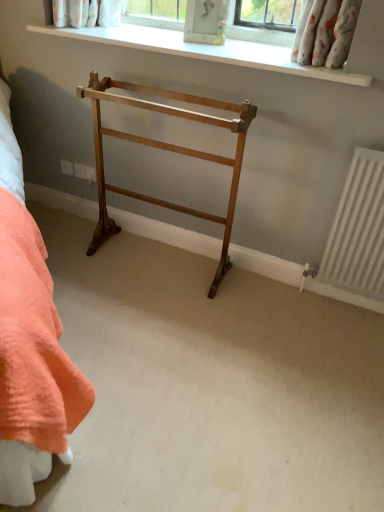
Question: Would you say white smooth window sill at upper center is outside light brown wood towel rack at center?

Choices:
 (A) no
 (B) yes

Answer: (B)

Question: Is white smooth window sill at upper center in contact with light brown wood towel rack at center?

Choices:
 (A) no
 (B) yes

Answer: (A)

Question: Is white smooth window sill at upper center taller than light brown wood towel rack at center?

Choices:
 (A) no
 (B) yes

Answer: (A)

Question: Is white smooth window sill at upper center bigger than light brown wood towel rack at center?

Choices:
 (A) no
 (B) yes

Answer: (A)

Question: Considering the relative sizes of white smooth window sill at upper center and light brown wood towel rack at center in the image provided, is white smooth window sill at upper center shorter than light brown wood towel rack at center?

Choices:
 (A) no
 (B) yes

Answer: (B)

Question: Would you consider white smooth window sill at upper center to be distant from light brown wood towel rack at center?

Choices:
 (A) yes
 (B) no

Answer: (B)

Question: Is light brown wood towel rack at center wider than white smooth window sill at upper center?

Choices:
 (A) yes
 (B) no

Answer: (B)

Question: Does light brown wood towel rack at center contain white smooth window sill at upper center?

Choices:
 (A) no
 (B) yes

Answer: (A)

Question: Does light brown wood towel rack at center lie behind white smooth window sill at upper center?

Choices:
 (A) no
 (B) yes

Answer: (A)

Question: Is light brown wood towel rack at center in front of white smooth window sill at upper center?

Choices:
 (A) no
 (B) yes

Answer: (B)

Question: Are light brown wood towel rack at center and white smooth window sill at upper center located far from each other?

Choices:
 (A) yes
 (B) no

Answer: (B)

Question: Can you confirm if light brown wood towel rack at center is thinner than white smooth window sill at upper center?

Choices:
 (A) no
 (B) yes

Answer: (B)

Question: Based on their positions, is light brown wood towel rack at center located to the left or right of white smooth window sill at upper center?

Choices:
 (A) right
 (B) left

Answer: (B)